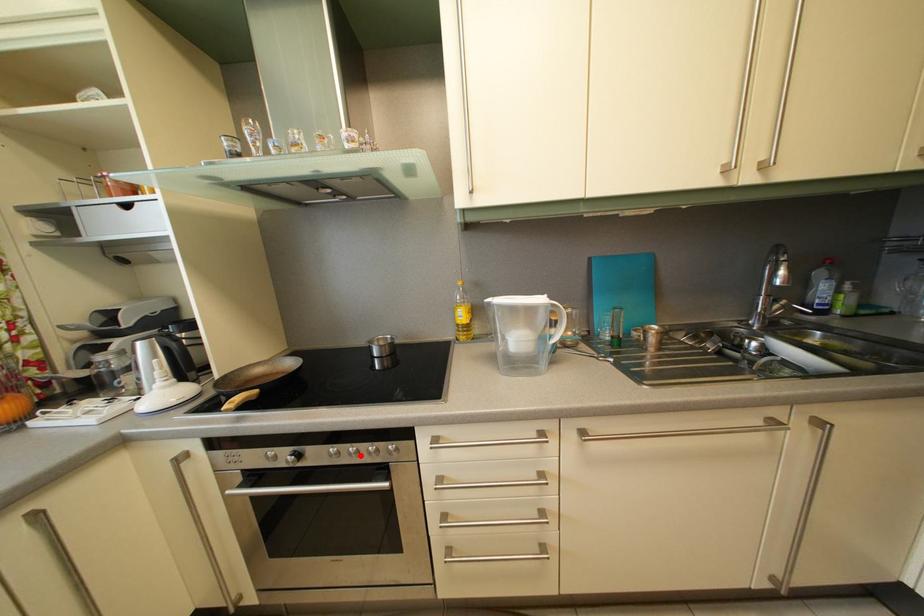
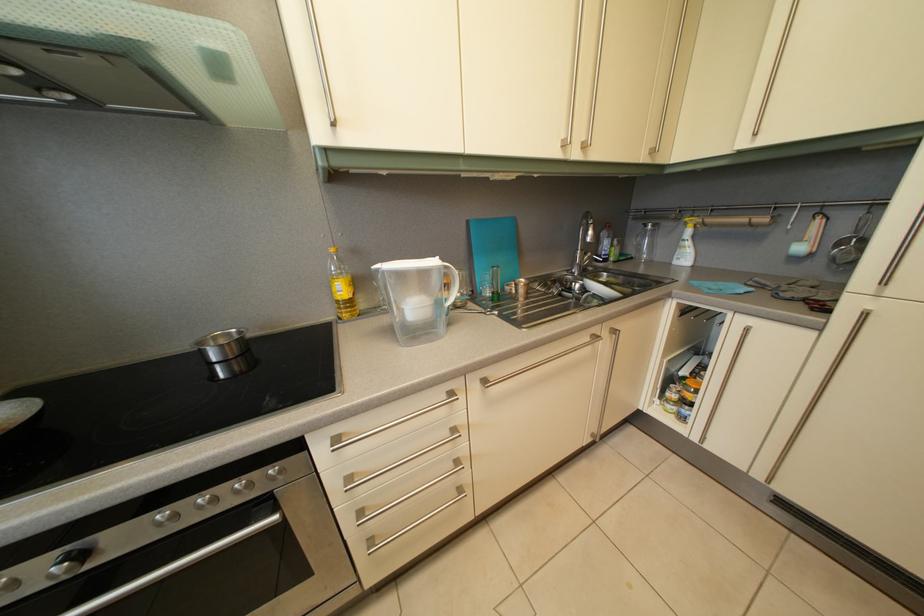
Where in the second image is the point corresponding to the highlighted location from the first image?

(211, 505)